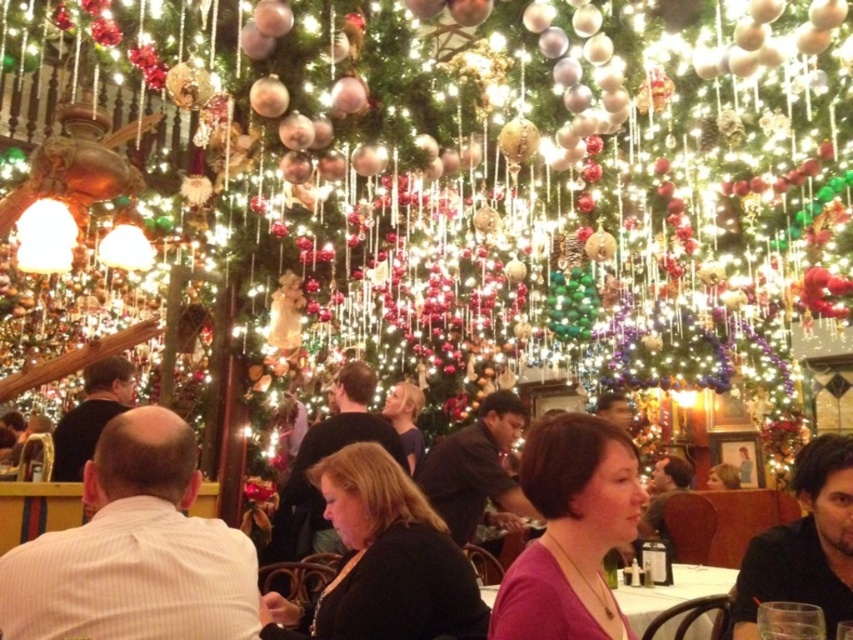
Question: Is dark brown hair at center positioned in front of purple matte shirt at center?

Choices:
 (A) no
 (B) yes

Answer: (A)

Question: Among these points, which one is nearest to the camera?

Choices:
 (A) (524, 456)
 (B) (180, 445)
 (C) (701, 616)

Answer: (B)

Question: Which point appears closest to the camera in this image?

Choices:
 (A) (212, 525)
 (B) (836, 582)

Answer: (A)

Question: Which object appears farthest from the camera in this image?

Choices:
 (A) white striped shirt at center
 (B) purple matte shirt at center

Answer: (B)

Question: Does purple matte shirt at center appear over black matte shirt at lower right?

Choices:
 (A) yes
 (B) no

Answer: (A)

Question: Is purple matte shirt at center further to camera compared to black matte shirt at lower right?

Choices:
 (A) no
 (B) yes

Answer: (A)